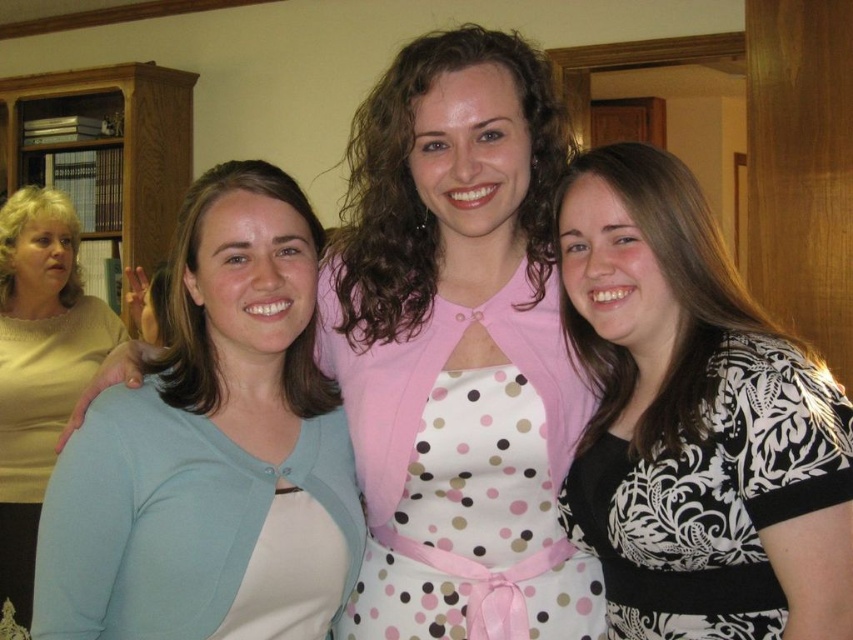
You are a photographer setting up for a group photo. You need to ensure that the pink polka dot dress at center and the polka dot apron at center are both visible in the frame. Given their sizes, which one might require more space in the composition?

The pink polka dot dress at center is larger in size than the polka dot apron at center, so it would require more space in the composition to ensure it is fully visible.